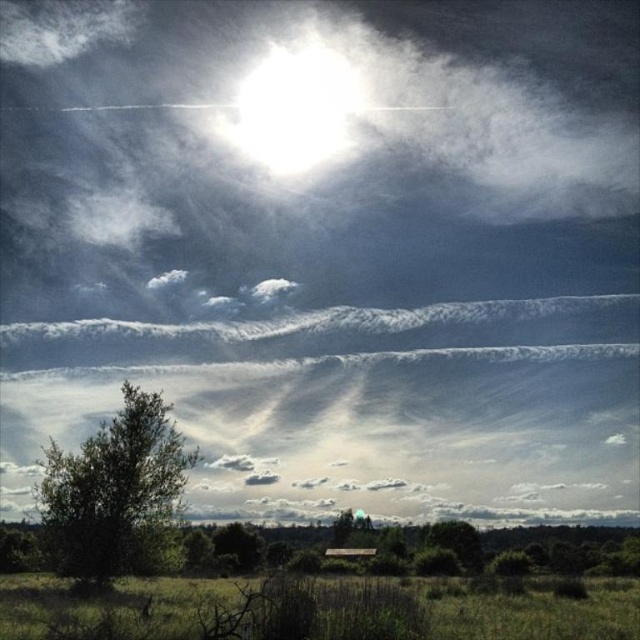
You are standing in the rural landscape scene. You see two points marked on the image. The first point is at coordinates point (138, 515) and the second point is at point (257, 138). Which point is closer to you?

Point (138, 515) is in front of point (257, 138), so it is closer to you.

You are an astronomer observing the sky and the landscape. You notice the green leafy tree at lower left and the white glossy sun at upper center. Which object is located to the left of the other?

The green leafy tree at lower left is positioned on the left side of white glossy sun at upper center.